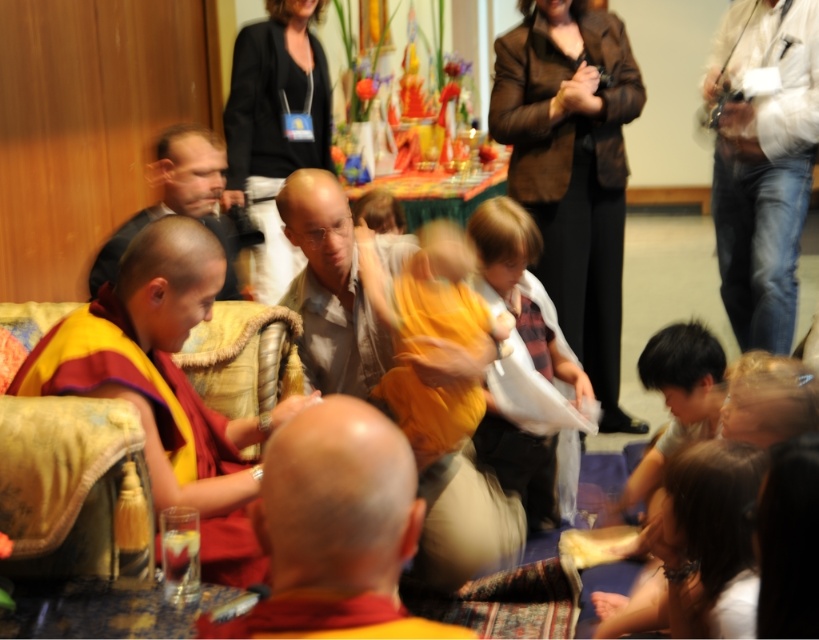
Question: Which is farther from the smooth bald head at center?

Choices:
 (A) white cotton shirt at right
 (B) plaid fabric robe at center
 (C) black matte robe at upper center

Answer: (A)

Question: Is red robe monk at left thinner than smooth bald head at center?

Choices:
 (A) no
 (B) yes

Answer: (A)

Question: Which of these objects is positioned farthest from the black matte robe at upper center?

Choices:
 (A) smooth bald head at center
 (B) bald head monk at center
 (C) red robe monk at left

Answer: (B)

Question: Which object is closer to the camera taking this photo?

Choices:
 (A) red robe monk at left
 (B) smooth bald head at center

Answer: (A)

Question: Can you confirm if white cotton shirt at right is wider than black matte robe at upper center?

Choices:
 (A) no
 (B) yes

Answer: (A)

Question: Does bald head monk at center come behind smooth bald head at center?

Choices:
 (A) no
 (B) yes

Answer: (A)